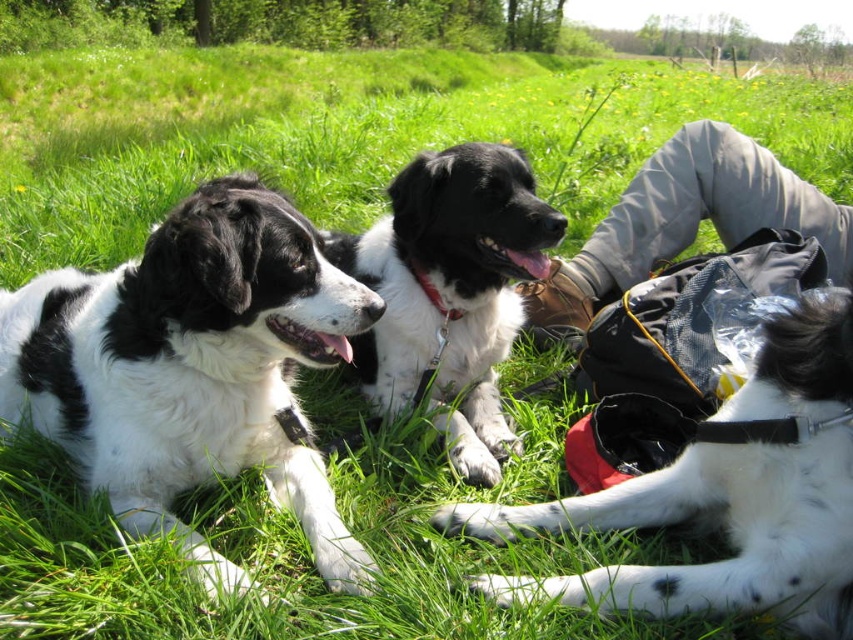
You are taking a photo of two points in the scene. The first point is at coordinate point (767, 429) and the second point is at coordinate point (553, 301). Which point will appear larger in your photo?

Point (767, 429) is closer to the camera than point (553, 301), so it will appear larger in the photo.